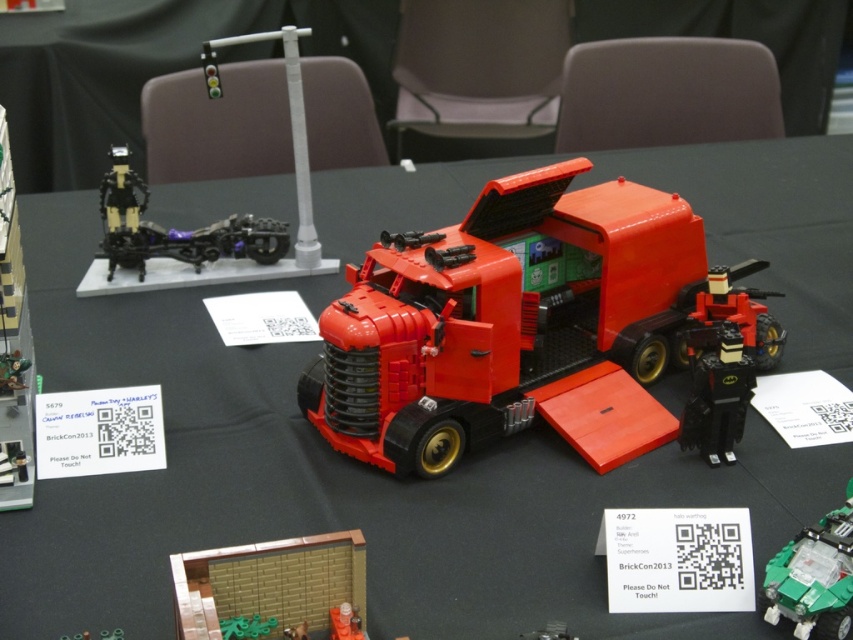
Can you confirm if black plastic motorcycle at upper left is taller than green metallic tower at left?

In fact, black plastic motorcycle at upper left may be shorter than green metallic tower at left.

Does black plastic motorcycle at upper left appear on the right side of green metallic tower at left?

Correct, you'll find black plastic motorcycle at upper left to the right of green metallic tower at left.

Who is more forward, (112, 253) or (26, 310)?

Point (26, 310) is more forward.

You are a GUI agent. You are given a task and a screenshot of the screen. Output one action in this format:
    pyautogui.click(x=<x>, y=<y>)
    Task: Click on the black plastic motorcycle at upper left
    This screenshot has height=640, width=853.
    Given the screenshot: What is the action you would take?
    pyautogui.click(x=175, y=228)

Does brick red plastic truck at center have a smaller size compared to orange matte truck at center?

Incorrect, brick red plastic truck at center is not smaller in size than orange matte truck at center.

Between point (762, 307) and point (331, 627), which one is positioned behind?

The point (762, 307) is behind.

Identify the location of brick red plastic truck at center. The width and height of the screenshot is (853, 640). (538, 330).

Which is below, green metallic tower at left or metallic silver spaceship at center?

Positioned lower is metallic silver spaceship at center.

Who is more distant from viewer, (9, 211) or (538, 628)?

Positioned behind is point (9, 211).

Identify the location of green metallic tower at left. tap(13, 348).